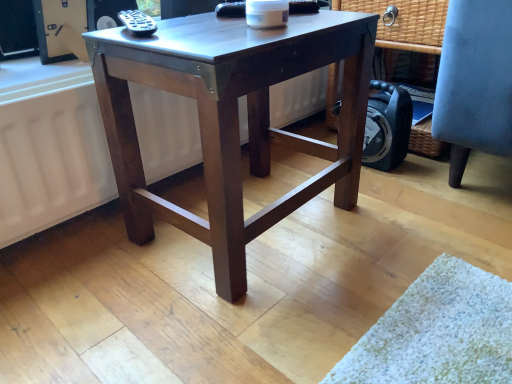
This screenshot has width=512, height=384. What are the coordinates of `free spot to the right of dark wood table at center` in the screenshot? It's located at (411, 227).